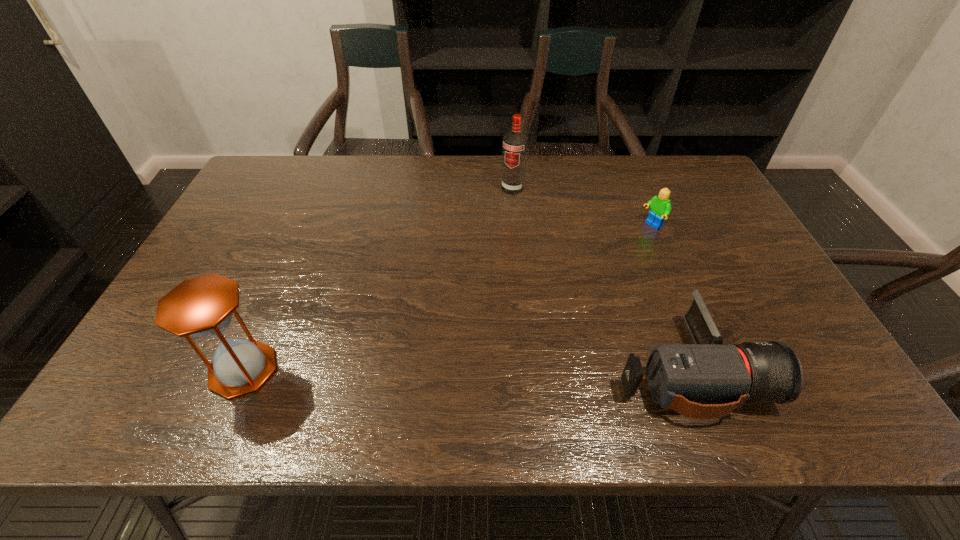
Identify the location of vacant spot on the desktop that is between the leftmost object and the camcorder and is positioned on the face of the Lego. tap(398, 369).

You are a GUI agent. You are given a task and a screenshot of the screen. Output one action in this format:
    pyautogui.click(x=<x>, y=<y>)
    Task: Click on the free space on the desktop that is between the leftmost object and the camcorder and is positioned on the front label of the farthest object
    The width and height of the screenshot is (960, 540).
    Given the screenshot: What is the action you would take?
    pyautogui.click(x=420, y=369)